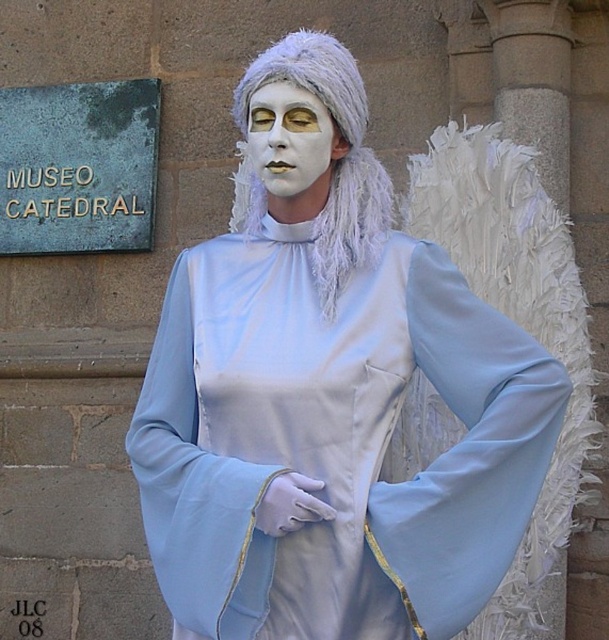
Question: Among these objects, which one is nearest to the camera?

Choices:
 (A) satin blue angel at center
 (B) white matte mask at center
 (C) white fluffy wig at center

Answer: (A)

Question: Which point is closer to the camera?

Choices:
 (A) (280, 77)
 (B) (276, 179)
 (C) (442, 534)

Answer: (C)

Question: Where is satin blue angel at center located in relation to white matte mask at center in the image?

Choices:
 (A) below
 (B) above

Answer: (A)

Question: Which point is closer to the camera?

Choices:
 (A) satin blue angel at center
 (B) white matte mask at center
 (C) white fluffy wig at center

Answer: (A)

Question: Does satin blue angel at center lie behind white matte mask at center?

Choices:
 (A) yes
 (B) no

Answer: (B)

Question: Is satin blue angel at center closer to camera compared to white fluffy wig at center?

Choices:
 (A) no
 (B) yes

Answer: (B)